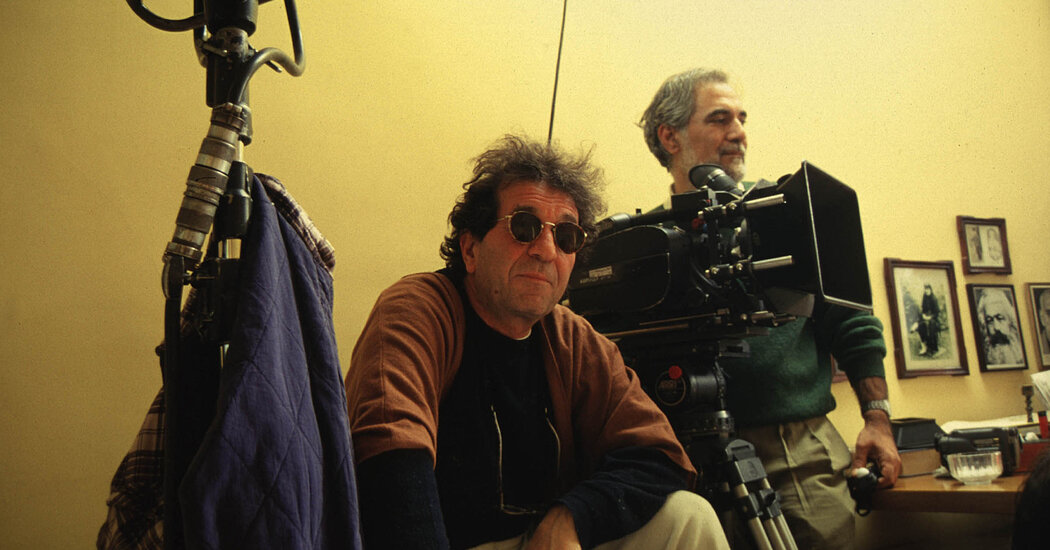
I want to click on solid light yellow wall in background, so click(x=825, y=56), click(x=386, y=47).